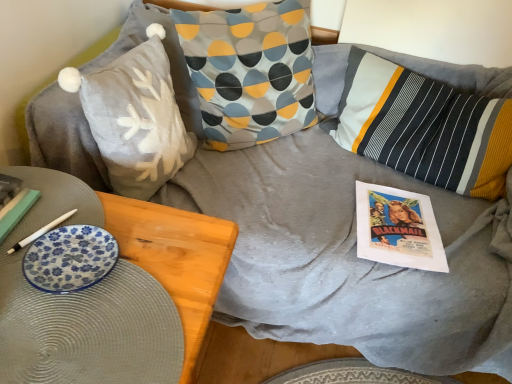
I want to click on free space above blue glazed plate at left (from a real-world perspective), so click(x=94, y=259).